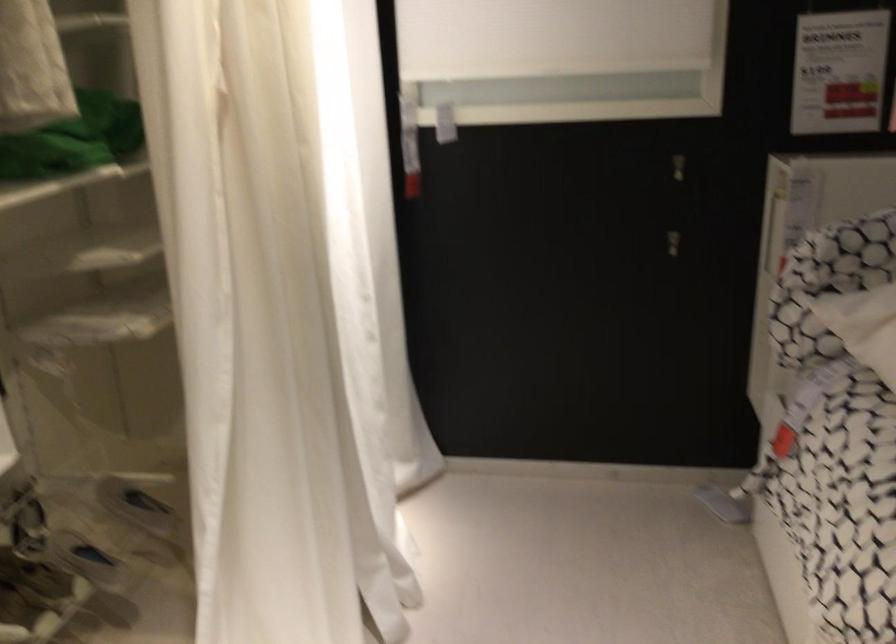
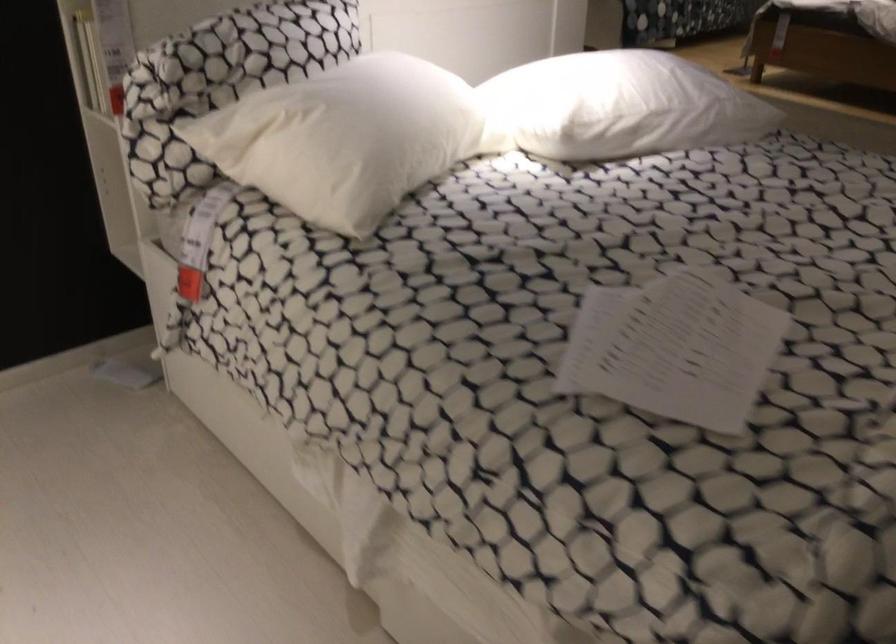
Question: The first image is from the beginning of the video and the second image is from the end. How did the camera likely rotate when shooting the video?

Choices:
 (A) Left
 (B) Right
 (C) Up
 (D) Down

Answer: (B)